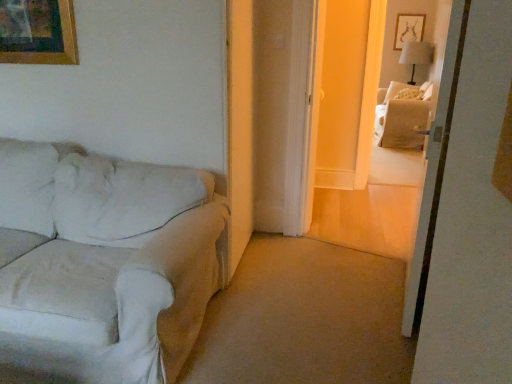
What do you see at coordinates (424, 34) in the screenshot?
I see `white fabric bed at upper right` at bounding box center [424, 34].

This screenshot has width=512, height=384. Describe the element at coordinates (434, 170) in the screenshot. I see `white fabric bed at upper right` at that location.

Find the location of a particular element. beige fabric couch at upper right is located at coordinates (402, 118).

Are white fabric couch at left and white fabric bed at upper right located far from each other?

Yes, white fabric couch at left and white fabric bed at upper right are quite far apart.

Is white fabric couch at left wider than white fabric bed at upper right?

Yes.

At what (x,y) coordinates should I click in order to perform the action: click on screen door on the right of white fabric couch at left. Please return your answer as a coordinate pair (x, y). The image size is (512, 384). Looking at the image, I should click on (434, 170).

Looking at the image, does white fabric couch at left seem bigger or smaller compared to white fabric bed at upper right?

Clearly, white fabric couch at left is larger in size than white fabric bed at upper right.

Is white fabric lampshade at upper right at the back of white fabric bed at upper right?

No.

Considering the relative sizes of white fabric bed at upper right and white fabric lampshade at upper right in the image provided, is white fabric bed at upper right thinner than white fabric lampshade at upper right?

Indeed, white fabric bed at upper right has a lesser width compared to white fabric lampshade at upper right.

Considering the relative sizes of white fabric bed at upper right and white fabric lampshade at upper right in the image provided, is white fabric bed at upper right bigger than white fabric lampshade at upper right?

Correct, white fabric bed at upper right is larger in size than white fabric lampshade at upper right.

Can you tell me how much white fabric bed at upper right and white fabric lampshade at upper right differ in facing direction?

There is a 100-degree angle between the facing directions of white fabric bed at upper right and white fabric lampshade at upper right.

From the image's perspective, which is above, white fabric bed at upper right or white fabric couch at left?

white fabric bed at upper right appears higher in the image.

From a real-world perspective, which object stands above the other?

white fabric bed at upper right is physically above.

Where is `window above the white fabric couch at left (from the image's perspective)`? The image size is (512, 384). window above the white fabric couch at left (from the image's perspective) is located at coordinates (424, 34).

From the image's perspective, relative to white fabric lampshade at upper right, is white fabric bed at upper right above or below?

Clearly, from the image's perspective, white fabric bed at upper right is below white fabric lampshade at upper right.

Is white fabric bed at upper right positioned with its back to white fabric lampshade at upper right?

Correct, white fabric bed at upper right is looking away from white fabric lampshade at upper right.

What are the coordinates of `window located underneath the white fabric lampshade at upper right (from a real-world perspective)` in the screenshot? It's located at (424, 34).

Which of these two, beige fabric couch at upper right or white fabric bed at upper right, is smaller?

white fabric bed at upper right is smaller.

Is there a large distance between beige fabric couch at upper right and white fabric bed at upper right?

Yes, beige fabric couch at upper right and white fabric bed at upper right are quite far apart.

Considering the sizes of beige fabric couch at upper right and white fabric bed at upper right in the image, is beige fabric couch at upper right bigger or smaller than white fabric bed at upper right?

Considering their sizes, beige fabric couch at upper right takes up more space than white fabric bed at upper right.

Is beige fabric couch at upper right positioned in front of white fabric bed at upper right?

That is False.

Is beige fabric couch at upper right looking in the opposite direction of white fabric bed at upper right?

That's not correct — beige fabric couch at upper right is not looking away from white fabric bed at upper right.

Between point (418, 107) and point (426, 72), which one is positioned in front?

The point (418, 107) is closer.

Is white fabric lampshade at upper right looking in the opposite direction of white fabric bed at upper right?

No, white fabric lampshade at upper right's orientation is not away from white fabric bed at upper right.

Who is bigger, white fabric lampshade at upper right or white fabric bed at upper right?

Bigger between the two is white fabric bed at upper right.

How many degrees apart are the facing directions of white fabric lampshade at upper right and white fabric bed at upper right?

white fabric lampshade at upper right and white fabric bed at upper right are facing 100 degrees away from each other.

In order to click on screen door that appears in front of the white fabric lampshade at upper right in this screenshot , I will do `click(434, 170)`.

Where is `studio couch below the white fabric bed at upper right (from the image's perspective)`? This screenshot has width=512, height=384. studio couch below the white fabric bed at upper right (from the image's perspective) is located at coordinates (104, 262).

Locate an element on the screen. screen door to the left of white fabric lampshade at upper right is located at coordinates (434, 170).

Based on their spatial positions, is white fabric lampshade at upper right or white fabric couch at left closer to beige fabric couch at upper right?

white fabric lampshade at upper right is positioned closer to the anchor beige fabric couch at upper right.

Looking at the image, which one is located closer to beige fabric couch at upper right, white fabric couch at left or white fabric bed at upper right?

The object closer to beige fabric couch at upper right is white fabric bed at upper right.

Considering their positions, is beige fabric couch at upper right positioned further to white fabric couch at left than white fabric bed at upper right?

Based on the image, white fabric bed at upper right appears to be further to white fabric couch at left.

Estimate the real-world distances between objects in this image. Which object is closer to white fabric bed at upper right, white fabric couch at left or beige fabric couch at upper right?

beige fabric couch at upper right is positioned closer to the anchor white fabric bed at upper right.

Based on their spatial positions, is beige fabric couch at upper right or white fabric bed at upper right closer to white fabric lampshade at upper right?

white fabric bed at upper right.

When comparing their distances from beige fabric couch at upper right, does white fabric bed at upper right or white fabric couch at left seem closer?

Among the two, white fabric bed at upper right is located nearer to beige fabric couch at upper right.

Considering their positions, is beige fabric couch at upper right positioned closer to white fabric bed at upper right than white fabric bed at upper right?

beige fabric couch at upper right is positioned closer to the anchor white fabric bed at upper right.

Estimate the real-world distances between objects in this image. Which object is closer to white fabric bed at upper right, white fabric bed at upper right or beige fabric couch at upper right?

beige fabric couch at upper right is positioned closer to the anchor white fabric bed at upper right.

Locate an element on the screen. This screenshot has width=512, height=384. window between white fabric couch at left and beige fabric couch at upper right in the front-back direction is located at coordinates (424, 34).

The image size is (512, 384). I want to click on screen door located between white fabric couch at left and white fabric lampshade at upper right in the depth direction, so click(x=434, y=170).

Identify the location of couch located between white fabric couch at left and white fabric lampshade at upper right in the depth direction. (402, 118).

Find the location of `couch between white fabric bed at upper right and white fabric lampshade at upper right in the front-back direction`. couch between white fabric bed at upper right and white fabric lampshade at upper right in the front-back direction is located at coordinates (402, 118).